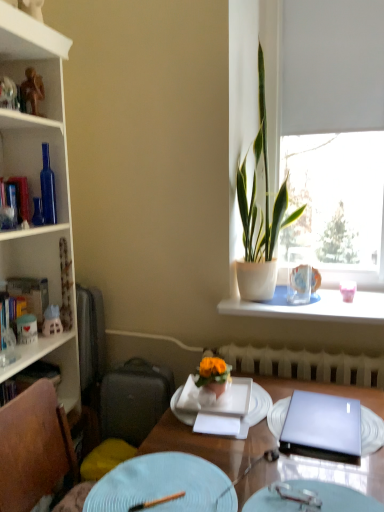
Find the location of a particular element. free space to the left of white paper at center is located at coordinates (174, 438).